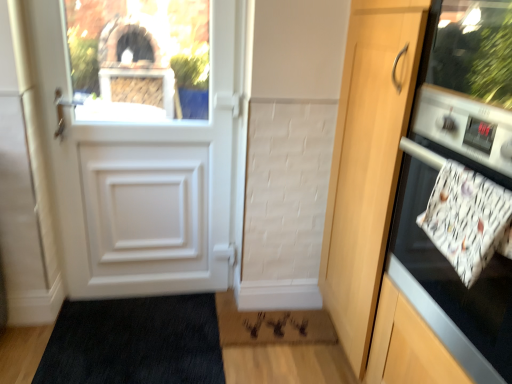
Measure the distance between point (303, 328) and camera.

They are 2.02 meters apart.

The image size is (512, 384). What do you see at coordinates (270, 325) in the screenshot?
I see `rug with textured pile at lower center` at bounding box center [270, 325].

What do you see at coordinates (140, 58) in the screenshot? The width and height of the screenshot is (512, 384). I see `matte glass window screen at upper left` at bounding box center [140, 58].

The width and height of the screenshot is (512, 384). What do you see at coordinates (368, 162) in the screenshot?
I see `wooden door at right` at bounding box center [368, 162].

Where is `rug with textured pile at lower center`? The image size is (512, 384). rug with textured pile at lower center is located at coordinates (270, 325).

Between point (411, 187) and point (401, 81), which one is positioned in front?

The point (401, 81) is closer to the camera.

How different are the orientations of white glossy oven at right and wooden door at right in degrees?

The angle between the facing direction of white glossy oven at right and the facing direction of wooden door at right is 5.62e-05 degrees.

Is white glossy oven at right to the left or to the right of wooden door at right in the image?

In the image, white glossy oven at right appears on the right side of wooden door at right.

Who is taller, white glossy oven at right or wooden door at right?

wooden door at right.

Is point (380, 115) more distant than point (151, 64)?

That is False.

What's the angular difference between wooden door at right and matte glass window screen at upper left's facing directions?

The angle between the facing direction of wooden door at right and the facing direction of matte glass window screen at upper left is 88 degrees.

Considering the sizes of objects wooden door at right and matte glass window screen at upper left in the image provided, who is thinner, wooden door at right or matte glass window screen at upper left?

With smaller width is matte glass window screen at upper left.

Between rug with textured pile at lower center and white glossy oven at right, which one appears on the right side from the viewer's perspective?

From the viewer's perspective, white glossy oven at right appears more on the right side.

Considering the sizes of rug with textured pile at lower center and white glossy oven at right in the image, is rug with textured pile at lower center wider or thinner than white glossy oven at right?

Clearly, rug with textured pile at lower center has less width compared to white glossy oven at right.

Does rug with textured pile at lower center come in front of white glossy oven at right?

No, it is behind white glossy oven at right.

From a real-world perspective, is rug with textured pile at lower center physically above white glossy oven at right?

No, from a real-world perspective, rug with textured pile at lower center is not above white glossy oven at right.

The image size is (512, 384). Find the location of `window screen to the left of rug with textured pile at lower center`. window screen to the left of rug with textured pile at lower center is located at coordinates (140, 58).

Is matte glass window screen at upper left outside of rug with textured pile at lower center?

Indeed, matte glass window screen at upper left is completely outside rug with textured pile at lower center.

Considering the sizes of matte glass window screen at upper left and rug with textured pile at lower center in the image, is matte glass window screen at upper left wider or thinner than rug with textured pile at lower center?

Clearly, matte glass window screen at upper left has less width compared to rug with textured pile at lower center.

From a real-world perspective, is matte glass window screen at upper left physically above rug with textured pile at lower center?

Yes, from a real-world perspective, matte glass window screen at upper left is on top of rug with textured pile at lower center.

Is matte glass window screen at upper left taller than white glossy oven at right?

No, matte glass window screen at upper left is not taller than white glossy oven at right.

Is matte glass window screen at upper left inside the boundaries of white glossy oven at right, or outside?

matte glass window screen at upper left lies outside white glossy oven at right.

Between point (98, 15) and point (455, 159), which one is positioned behind?

Positioned behind is point (98, 15).

Would you say white glossy oven at right is a long distance from rug with textured pile at lower center?

They are positioned close to each other.

Which is in front, point (509, 264) or point (314, 339)?

The point (509, 264) is in front.

Does white glossy oven at right have a smaller size compared to rug with textured pile at lower center?

Incorrect, white glossy oven at right is not smaller in size than rug with textured pile at lower center.

Would you say white glossy oven at right is to the left or to the right of rug with textured pile at lower center in the picture?

In the image, white glossy oven at right appears on the right side of rug with textured pile at lower center.

Is rug with textured pile at lower center next to wooden door at right and touching it?

There is a gap between rug with textured pile at lower center and wooden door at right.

Considering the relative sizes of rug with textured pile at lower center and wooden door at right in the image provided, is rug with textured pile at lower center shorter than wooden door at right?

Correct, rug with textured pile at lower center is not as tall as wooden door at right.

Is rug with textured pile at lower center looking in the opposite direction of wooden door at right?

rug with textured pile at lower center does not have its back to wooden door at right.

At what (x,y) coordinates should I click in order to perform the action: click on oven above the wooden door at right (from the image's perspective). Please return your answer as a coordinate pair (x, y). The width and height of the screenshot is (512, 384). Looking at the image, I should click on (451, 285).

I want to click on window screen behind the wooden door at right, so click(x=140, y=58).

When comparing their distances from rug with textured pile at lower center, does wooden door at right or white glossy oven at right seem further?

white glossy oven at right is positioned further to the anchor rug with textured pile at lower center.

Considering their positions, is rug with textured pile at lower center positioned closer to white glossy oven at right than wooden door at right?

wooden door at right is positioned closer to the anchor white glossy oven at right.

Considering their positions, is white glossy oven at right positioned further to matte glass window screen at upper left than rug with textured pile at lower center?

Among the two, white glossy oven at right is located further to matte glass window screen at upper left.

Looking at this image, based on their spatial positions, is white glossy oven at right or matte glass window screen at upper left closer to wooden door at right?

white glossy oven at right lies closer to wooden door at right than the other object.

Based on their spatial positions, is rug with textured pile at lower center or matte glass window screen at upper left further from wooden door at right?

matte glass window screen at upper left lies further to wooden door at right than the other object.

Based on the photo, considering their positions, is wooden door at right positioned closer to white glossy oven at right than rug with textured pile at lower center?

Among the two, wooden door at right is located nearer to white glossy oven at right.

Based on their spatial positions, is matte glass window screen at upper left or wooden door at right further from rug with textured pile at lower center?

Among the two, matte glass window screen at upper left is located further to rug with textured pile at lower center.

Estimate the real-world distances between objects in this image. Which object is further from wooden door at right, matte glass window screen at upper left or white glossy oven at right?

matte glass window screen at upper left is further to wooden door at right.

At what (x,y) coordinates should I click in order to perform the action: click on window screen between white glossy oven at right and rug with textured pile at lower center from front to back. Please return your answer as a coordinate pair (x, y). This screenshot has width=512, height=384. Looking at the image, I should click on (140, 58).

This screenshot has width=512, height=384. In order to click on oven located between wooden door at right and matte glass window screen at upper left in the depth direction in this screenshot , I will do `click(451, 285)`.

Where is `window screen located between wooden door at right and rug with textured pile at lower center in the depth direction`? window screen located between wooden door at right and rug with textured pile at lower center in the depth direction is located at coordinates (140, 58).

This screenshot has width=512, height=384. I want to click on oven positioned between wooden door at right and rug with textured pile at lower center from near to far, so click(x=451, y=285).